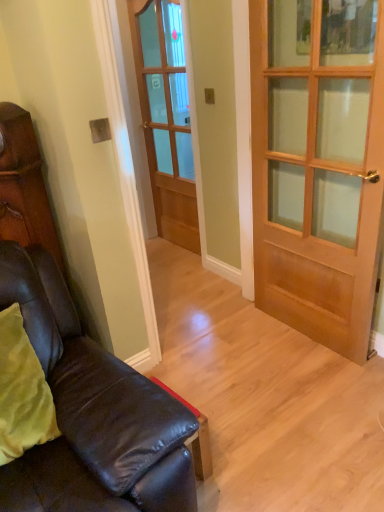
Question: Considering their positions, is wooden glass door at center, the first door from the back, located in front of or behind leather couch at lower left?

Choices:
 (A) behind
 (B) front

Answer: (A)

Question: From a real-world perspective, is wooden glass door at center, the first door in the left-to-right sequence, above or below leather couch at lower left?

Choices:
 (A) below
 (B) above

Answer: (B)

Question: Based on their relative distances, which object is farther from the wooden glass door at center, positioned as the 2th door in front-to-back order?

Choices:
 (A) leather couch at lower left
 (B) wooden door at center, arranged as the first door when viewed from the front
 (C) matte brown cabinet at left

Answer: (A)

Question: Estimate the real-world distances between objects in this image. Which object is closer to the wooden glass door at center, the first door from the back?

Choices:
 (A) leather couch at lower left
 (B) wooden door at center, placed as the 2th door when sorted from left to right
 (C) matte brown cabinet at left

Answer: (B)